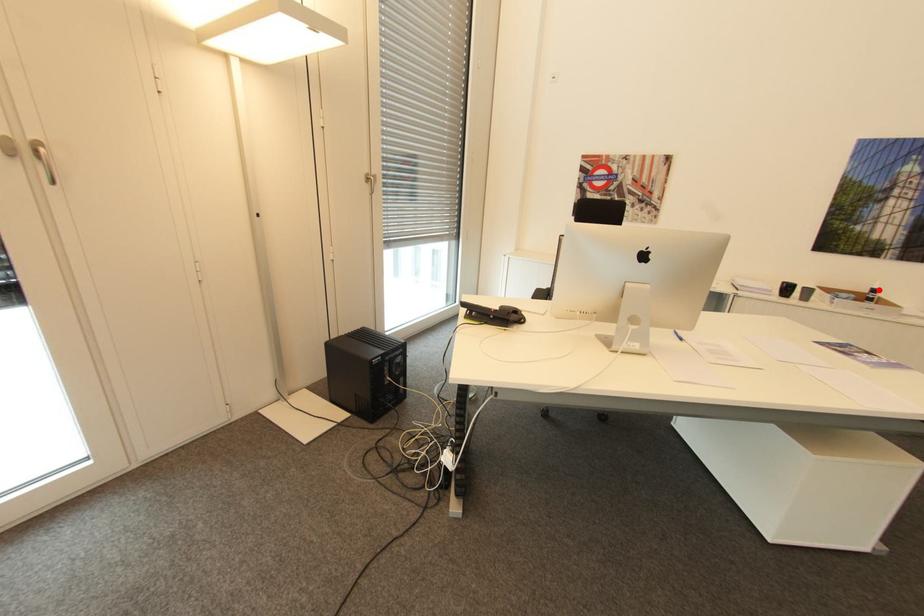
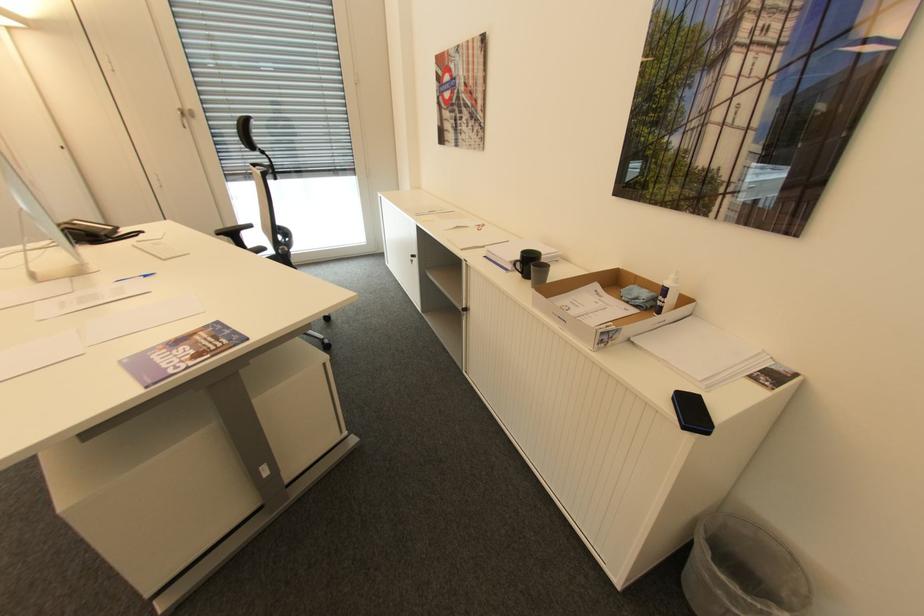
Where in the second image is the point corresponding to the highlighted location from the first image?

(670, 291)